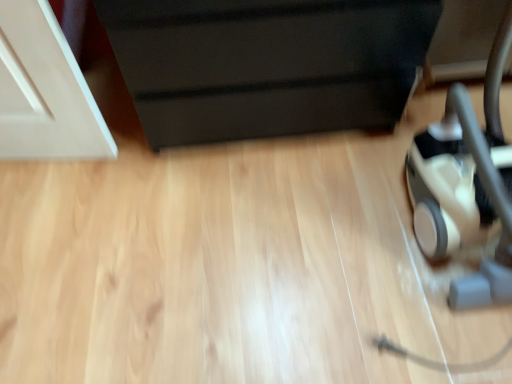
I want to click on vacant space that is in between black matte drawer at upper center and beige rubber baby carriage at lower right, so click(x=327, y=200).